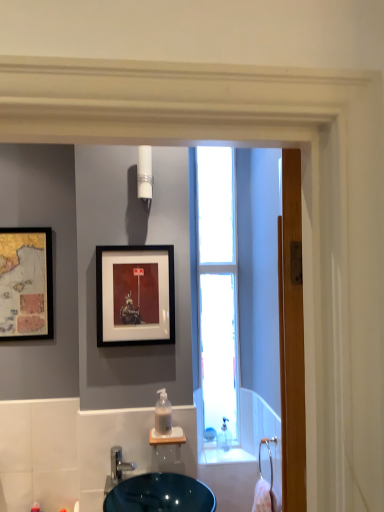
Question: Does white glossy light fixture at upper center have a larger size compared to transparent glass window at center?

Choices:
 (A) yes
 (B) no

Answer: (B)

Question: Is white glossy light fixture at upper center not within transparent glass window at center?

Choices:
 (A) yes
 (B) no

Answer: (A)

Question: From a real-world perspective, is white glossy light fixture at upper center located higher than transparent glass window at center?

Choices:
 (A) yes
 (B) no

Answer: (A)

Question: Does white glossy light fixture at upper center have a smaller size compared to transparent glass window at center?

Choices:
 (A) no
 (B) yes

Answer: (B)

Question: Is white glossy light fixture at upper center at the right side of transparent glass window at center?

Choices:
 (A) no
 (B) yes

Answer: (A)

Question: Does white glossy light fixture at upper center have a lesser width compared to transparent glass window at center?

Choices:
 (A) no
 (B) yes

Answer: (A)

Question: Are transparent glass window at center and wooden screen door at right located far from each other?

Choices:
 (A) no
 (B) yes

Answer: (A)

Question: Does transparent glass window at center have a greater width compared to wooden screen door at right?

Choices:
 (A) no
 (B) yes

Answer: (A)

Question: From the image's perspective, is transparent glass window at center beneath wooden screen door at right?

Choices:
 (A) no
 (B) yes

Answer: (A)

Question: Does transparent glass window at center contain wooden screen door at right?

Choices:
 (A) no
 (B) yes

Answer: (A)

Question: Is the depth of transparent glass window at center greater than that of wooden screen door at right?

Choices:
 (A) yes
 (B) no

Answer: (A)

Question: Does transparent glass window at center come in front of wooden screen door at right?

Choices:
 (A) no
 (B) yes

Answer: (A)

Question: Is wooden screen door at right located within matte black picture frame at center, marked as the 1th picture frame in a front-to-back arrangement?

Choices:
 (A) no
 (B) yes

Answer: (A)